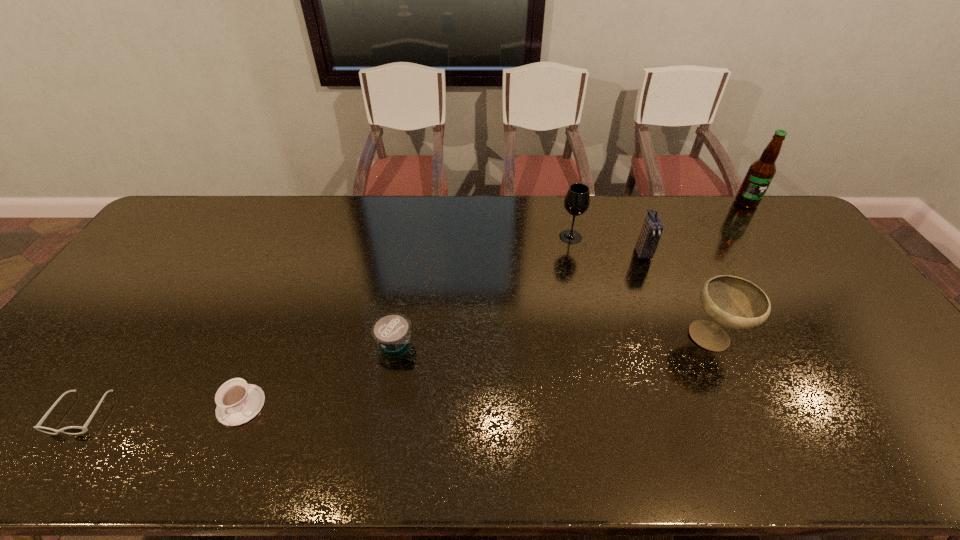
At what (x,y) coordinates should I click in order to perform the action: click on free space located on the front of the fourth object from left to right. Please return your answer as a coordinate pair (x, y). Looking at the image, I should click on (594, 339).

The image size is (960, 540). I want to click on vacant position located 0.370m on the back of the chalice, so click(x=663, y=232).

Find the location of a particular element. free space located 0.350m with the zip open on the clutch bag is located at coordinates (683, 355).

Where is `vacant area situated on the right of the fifth object from right to left`? vacant area situated on the right of the fifth object from right to left is located at coordinates (433, 342).

This screenshot has height=540, width=960. I want to click on beer bottle at the far edge, so pos(761,172).

Identify the location of wineglass situated at the far edge. This screenshot has height=540, width=960. (577, 200).

Where is `object situated at the near edge`? The width and height of the screenshot is (960, 540). object situated at the near edge is located at coordinates (74, 430).

Find the location of a particular element. The width and height of the screenshot is (960, 540). object that is at the left edge is located at coordinates (74, 430).

At what (x,y) coordinates should I click in order to perform the action: click on object present at the right edge. Please return your answer as a coordinate pair (x, y). Looking at the image, I should click on (761, 172).

At what (x,y) coordinates should I click in order to perform the action: click on object that is at the near left corner. Please return your answer as a coordinate pair (x, y). The height and width of the screenshot is (540, 960). Looking at the image, I should click on (74, 430).